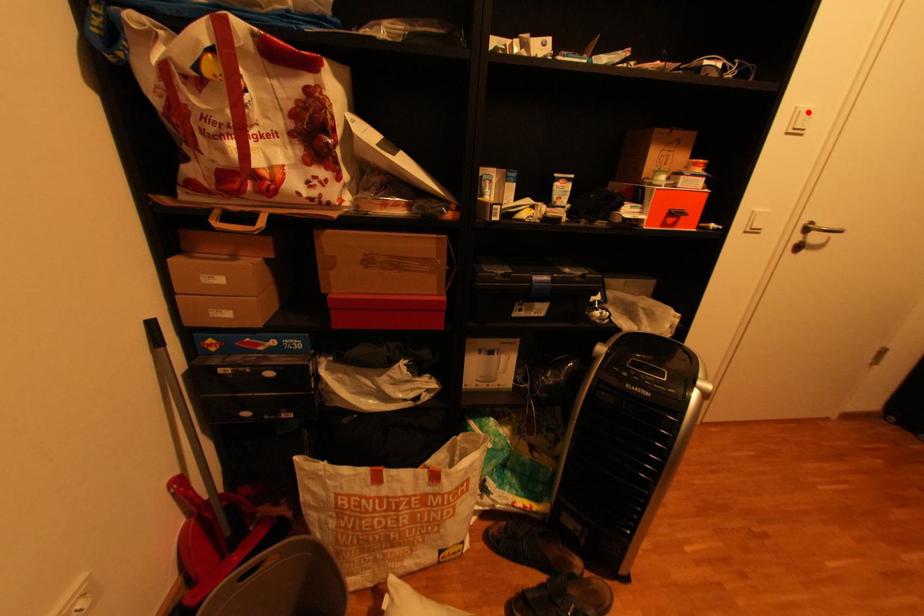
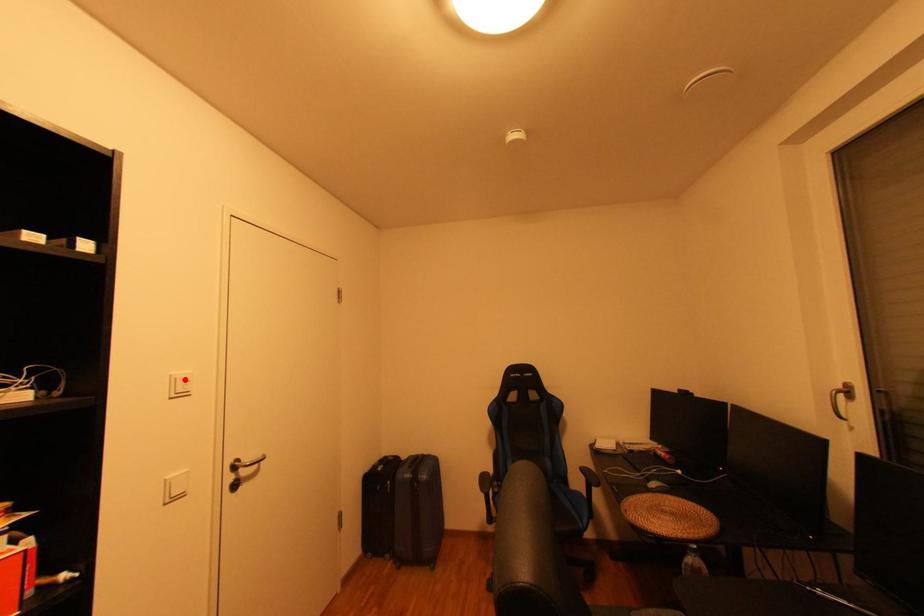
I am providing you with two images of the same scene from different viewpoints. A red point is marked on the first image and another point is marked on the second image. Do the highlighted points in image1 and image2 indicate the same real-world spot?

Yes